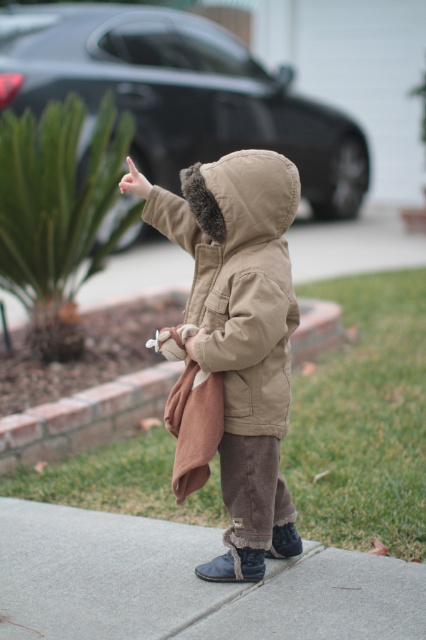
Question: Can you confirm if shiny black car at upper center is positioned above brown fabric at center?

Choices:
 (A) no
 (B) yes

Answer: (B)

Question: Is shiny black car at upper center wider than light skin tone flesh at upper center?

Choices:
 (A) yes
 (B) no

Answer: (A)

Question: Which of the following is the closest to the observer?

Choices:
 (A) gray concrete sidewalk at lower center
 (B) shiny black car at upper center

Answer: (A)

Question: Which point is closer to the camera taking this photo?

Choices:
 (A) (163, 173)
 (B) (149, 620)
 (C) (143, 390)

Answer: (B)

Question: Among these objects, which one is farthest from the camera?

Choices:
 (A) brown fabric at center
 (B) shiny black car at upper center
 (C) light skin tone flesh at upper center

Answer: (B)

Question: Does brown fabric at center appear under light skin tone flesh at upper center?

Choices:
 (A) no
 (B) yes

Answer: (B)